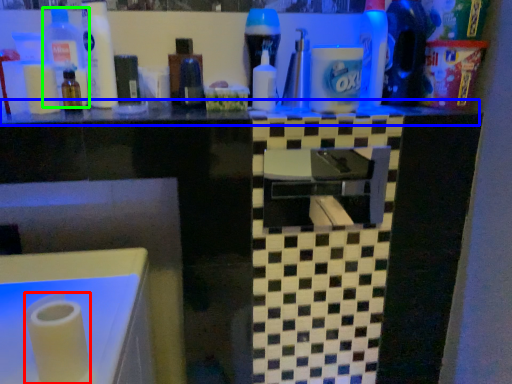
Question: Which object is positioned closest to paper towel (highlighted by a red box)? Select from counter top (highlighted by a blue box) and bottle (highlighted by a green box).

Choices:
 (A) counter top
 (B) bottle

Answer: (A)